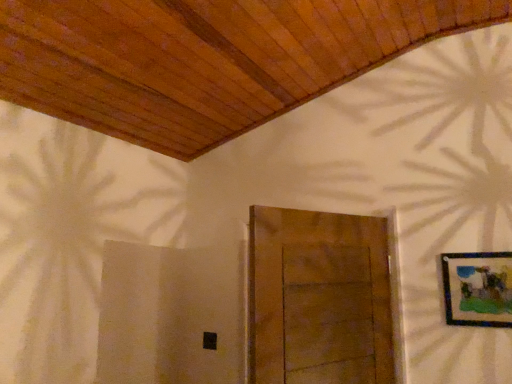
The width and height of the screenshot is (512, 384). In order to click on wooden-framed artwork at upper right in this screenshot , I will do `click(477, 289)`.

Describe the element at coordinates (477, 289) in the screenshot. I see `wooden-framed artwork at upper right` at that location.

Image resolution: width=512 pixels, height=384 pixels. What do you see at coordinates (320, 299) in the screenshot?
I see `wooden door at center` at bounding box center [320, 299].

Where is `wooden door at center`? The width and height of the screenshot is (512, 384). wooden door at center is located at coordinates (320, 299).

Locate an element on the screen. wooden-framed artwork at upper right is located at coordinates (477, 289).

Visually, is wooden-framed artwork at upper right positioned to the left or to the right of wooden door at center?

wooden-framed artwork at upper right is to the right of wooden door at center.

Is the position of wooden-framed artwork at upper right more distant than that of wooden door at center?

Yes, the depth of wooden-framed artwork at upper right is greater than that of wooden door at center.

Which is less distant, (471, 314) or (378, 281)?

Clearly, point (471, 314) is closer to the camera than point (378, 281).

From the image's perspective, which is above, wooden-framed artwork at upper right or wooden door at center?

wooden-framed artwork at upper right.

From a real-world perspective, between wooden-framed artwork at upper right and wooden door at center, who is vertically higher?

Result: wooden-framed artwork at upper right.

In the scene shown: Is wooden-framed artwork at upper right thinner than wooden door at center?

Indeed, wooden-framed artwork at upper right has a lesser width compared to wooden door at center.

Considering the sizes of wooden-framed artwork at upper right and wooden door at center in the image, is wooden-framed artwork at upper right taller or shorter than wooden door at center?

In the image, wooden-framed artwork at upper right appears to be shorter than wooden door at center.

Which of these two, wooden-framed artwork at upper right or wooden door at center, is smaller?

wooden-framed artwork at upper right is smaller.

Is wooden door at center located within wooden-framed artwork at upper right?

No, wooden-framed artwork at upper right does not contain wooden door at center.

Looking at this image, would you say wooden-framed artwork at upper right is a long distance from wooden door at center?

They are positioned close to each other.

Does wooden-framed artwork at upper right turn towards wooden door at center?

No, wooden-framed artwork at upper right is not oriented towards wooden door at center.

Find the location of a particular element. The height and width of the screenshot is (384, 512). picture frame located above the wooden door at center (from a real-world perspective) is located at coordinates (477, 289).

Is wooden door at center at the right side of wooden-framed artwork at upper right?

In fact, wooden door at center is to the left of wooden-framed artwork at upper right.

Does wooden door at center come in front of wooden-framed artwork at upper right?

Yes, wooden door at center is in front of wooden-framed artwork at upper right.

Is point (254, 246) farther from camera compared to point (497, 295)?

No, it is not.

From the picture: From the image's perspective, is wooden door at center on top of wooden-framed artwork at upper right?

No, from the image's perspective, wooden door at center is not on top of wooden-framed artwork at upper right.

From a real-world perspective, between wooden door at center and wooden-framed artwork at upper right, who is vertically lower?

wooden door at center, from a real-world perspective.

Is wooden door at center thinner than wooden-framed artwork at upper right?

No, wooden door at center is not thinner than wooden-framed artwork at upper right.

Which of these two, wooden door at center or wooden-framed artwork at upper right, stands taller?

Standing taller between the two is wooden door at center.

Between wooden door at center and wooden-framed artwork at upper right, which one has larger size?

With larger size is wooden door at center.

Is wooden door at center surrounding wooden-framed artwork at upper right?

No, wooden-framed artwork at upper right is located outside of wooden door at center.

Is wooden door at center positioned far away from wooden-framed artwork at upper right?

No, there isn't a large distance between wooden door at center and wooden-framed artwork at upper right.

Is wooden door at center oriented away from wooden-framed artwork at upper right?

No, wooden-framed artwork at upper right is not at the back of wooden door at center.

The height and width of the screenshot is (384, 512). I want to click on door that appears below the wooden-framed artwork at upper right (from the image's perspective), so tap(320, 299).

What are the coordinates of `door located below the wooden-framed artwork at upper right (from the image's perspective)` in the screenshot? It's located at (320, 299).

The width and height of the screenshot is (512, 384). In order to click on picture frame on the right of the wooden door at center in this screenshot , I will do `click(477, 289)`.